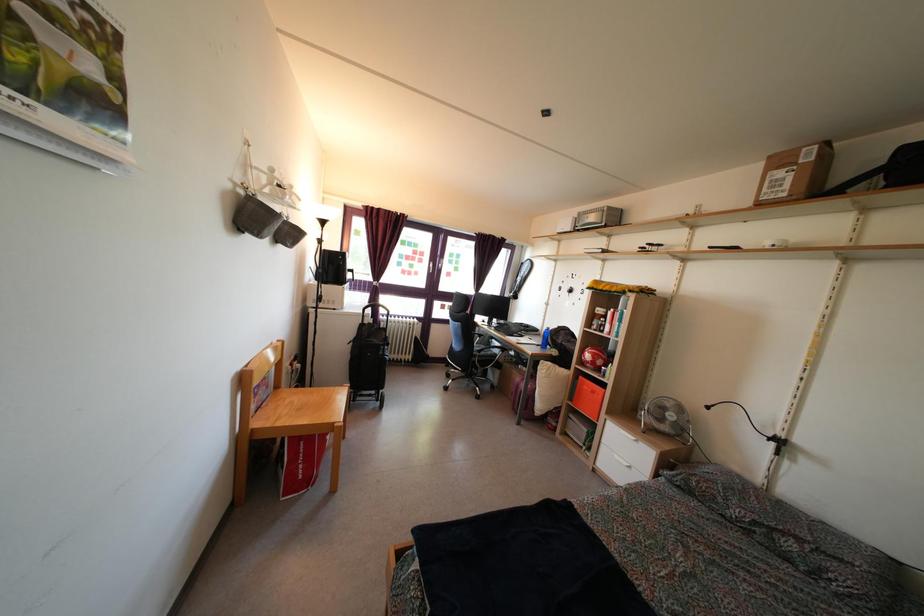
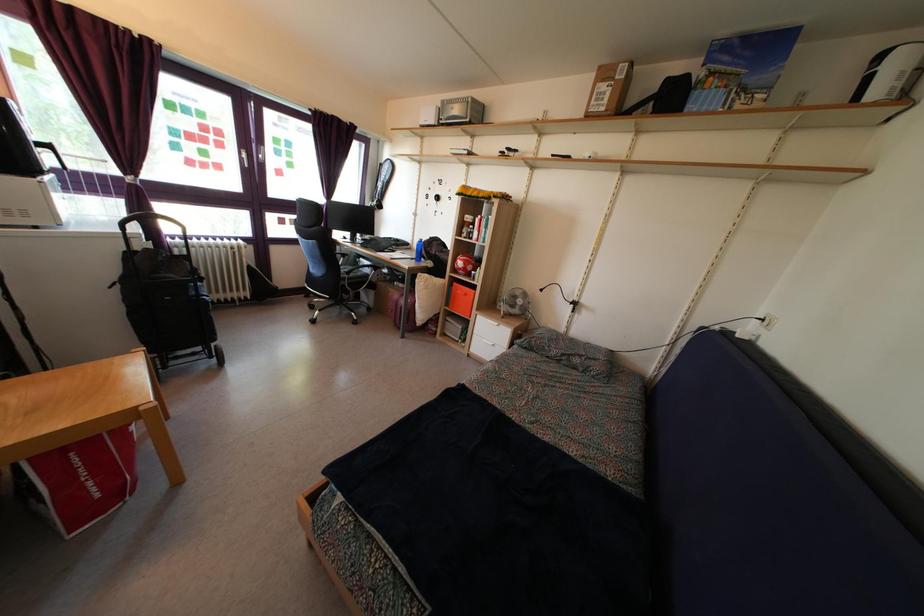
In the second image, find the point that corresponds to (x=811, y=163) in the first image.

(624, 79)